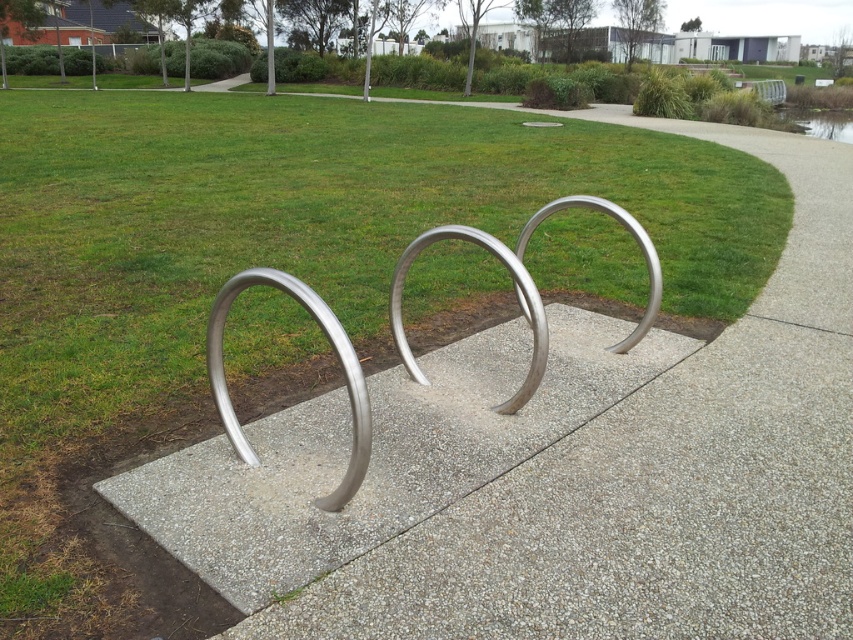
Question: Does sanded concrete at center have a smaller size compared to polished metal bike rack at center?

Choices:
 (A) no
 (B) yes

Answer: (A)

Question: Which point is farther from the camera taking this photo?

Choices:
 (A) (242, 436)
 (B) (627, 356)

Answer: (B)

Question: Is sanded concrete at center positioned in front of polished metal bike rack at center?

Choices:
 (A) yes
 (B) no

Answer: (A)

Question: Which of the following is the farthest from the observer?

Choices:
 (A) (666, 339)
 (B) (347, 477)

Answer: (A)

Question: Can you confirm if sanded concrete at center is positioned above polished metal bike rack at center?

Choices:
 (A) yes
 (B) no

Answer: (B)